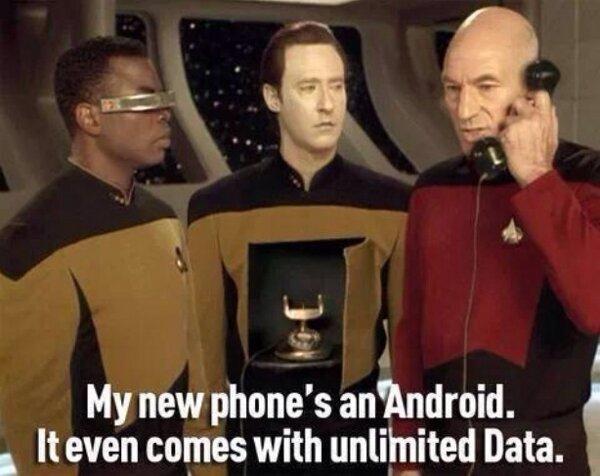
Locate an element on the screen. phone is located at coordinates (545, 80), (306, 343).